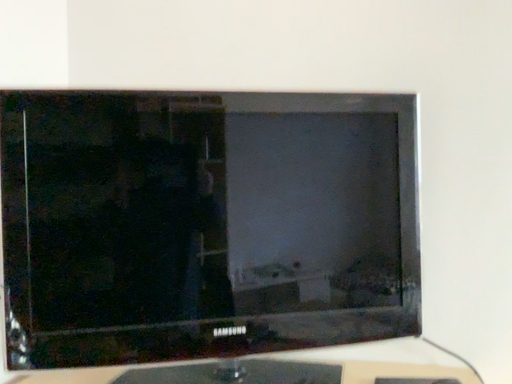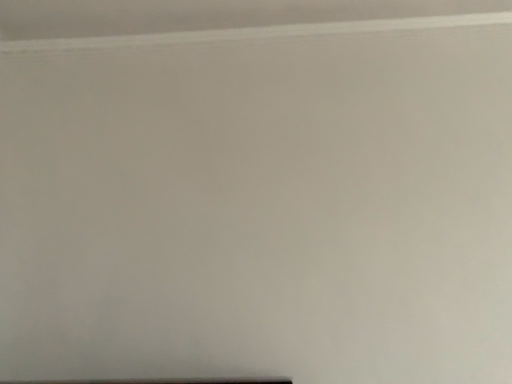
Question: How did the camera likely rotate when shooting the video?

Choices:
 (A) rotated downward
 (B) rotated upward

Answer: (B)